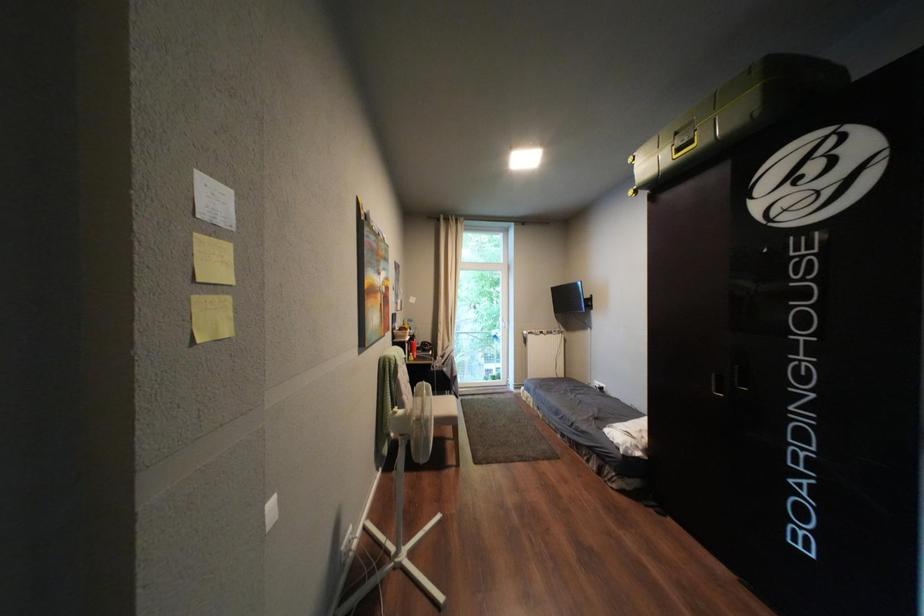
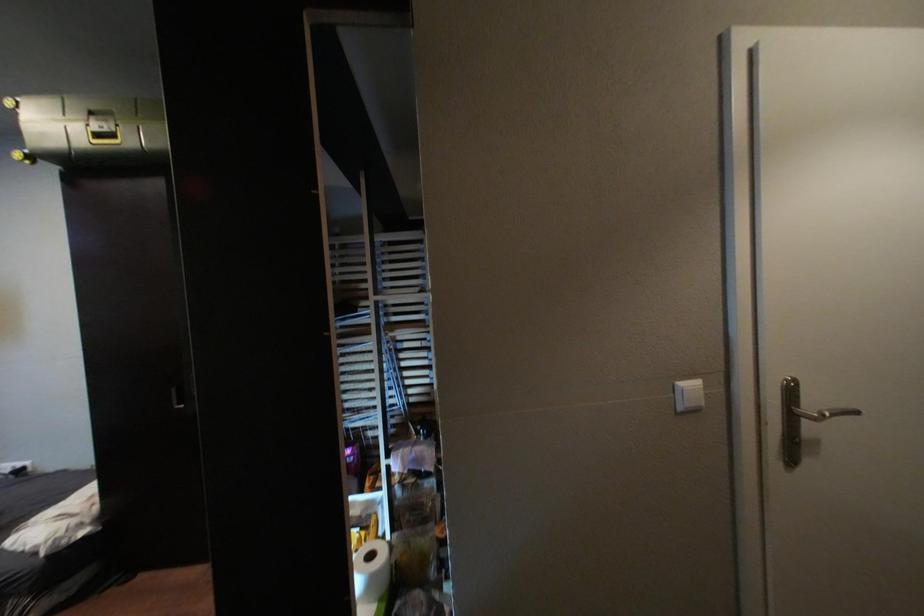
Question: The camera is either moving clockwise (left) or counter-clockwise (right) around the object. The first image is from the beginning of the video and the second image is from the end. Is the camera moving left or right when shooting the video?

Choices:
 (A) Left
 (B) Right

Answer: (A)